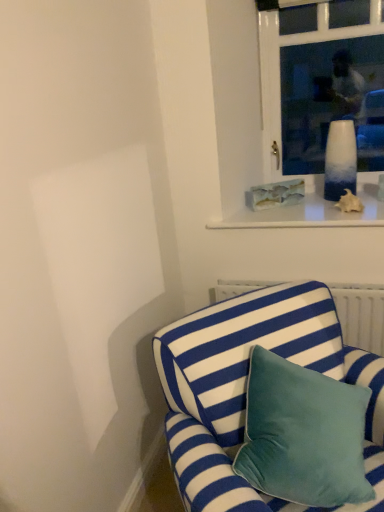
Question: Considering the relative sizes of translucent glass vase at upper right and white glass vase at upper center in the image provided, is translucent glass vase at upper right smaller than white glass vase at upper center?

Choices:
 (A) no
 (B) yes

Answer: (B)

Question: Is translucent glass vase at upper right facing towards white glass vase at upper center?

Choices:
 (A) yes
 (B) no

Answer: (B)

Question: Can you confirm if translucent glass vase at upper right is bigger than white glass vase at upper center?

Choices:
 (A) no
 (B) yes

Answer: (A)

Question: Is translucent glass vase at upper right oriented away from white glass vase at upper center?

Choices:
 (A) no
 (B) yes

Answer: (B)

Question: Does translucent glass vase at upper right come in front of white glass vase at upper center?

Choices:
 (A) no
 (B) yes

Answer: (A)

Question: Considering the relative sizes of translucent glass vase at upper right and white glass vase at upper center in the image provided, is translucent glass vase at upper right thinner than white glass vase at upper center?

Choices:
 (A) no
 (B) yes

Answer: (A)

Question: Is white glass vase at upper center at the right side of translucent glass vase at upper right?

Choices:
 (A) no
 (B) yes

Answer: (A)

Question: Is white glass vase at upper center not within translucent glass vase at upper right?

Choices:
 (A) no
 (B) yes

Answer: (B)

Question: Considering the relative sizes of white glass vase at upper center and translucent glass vase at upper right in the image provided, is white glass vase at upper center wider than translucent glass vase at upper right?

Choices:
 (A) yes
 (B) no

Answer: (B)

Question: Does white glass vase at upper center come behind translucent glass vase at upper right?

Choices:
 (A) no
 (B) yes

Answer: (A)

Question: Can you confirm if white glass vase at upper center is smaller than translucent glass vase at upper right?

Choices:
 (A) yes
 (B) no

Answer: (B)

Question: Does white glass vase at upper center have a lesser width compared to translucent glass vase at upper right?

Choices:
 (A) yes
 (B) no

Answer: (A)

Question: Is blue and white striped fabric couch at lower right to the right of translucent glass vase at upper right from the viewer's perspective?

Choices:
 (A) yes
 (B) no

Answer: (B)